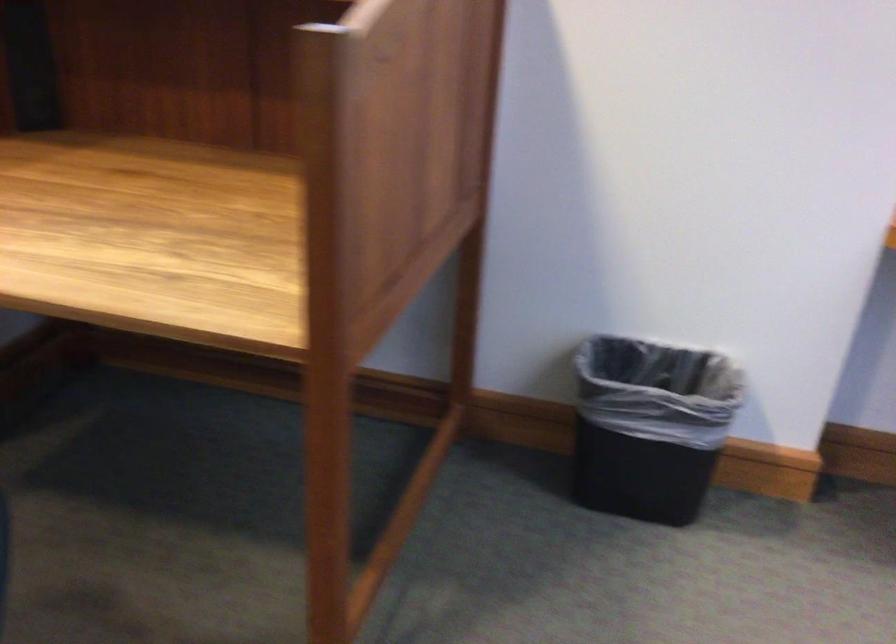
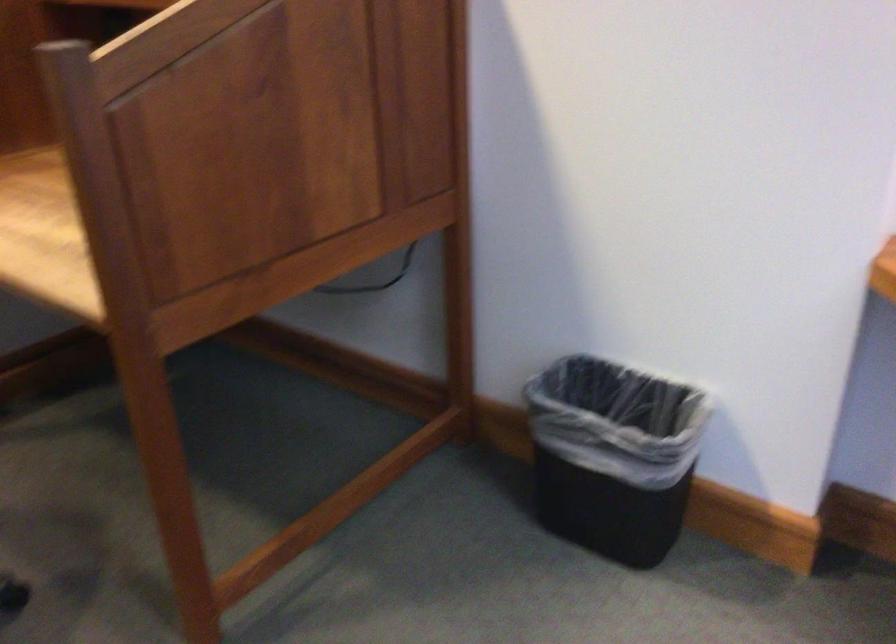
Where in the second image is the point corresponding to point 684,426 from the first image?

(613, 456)